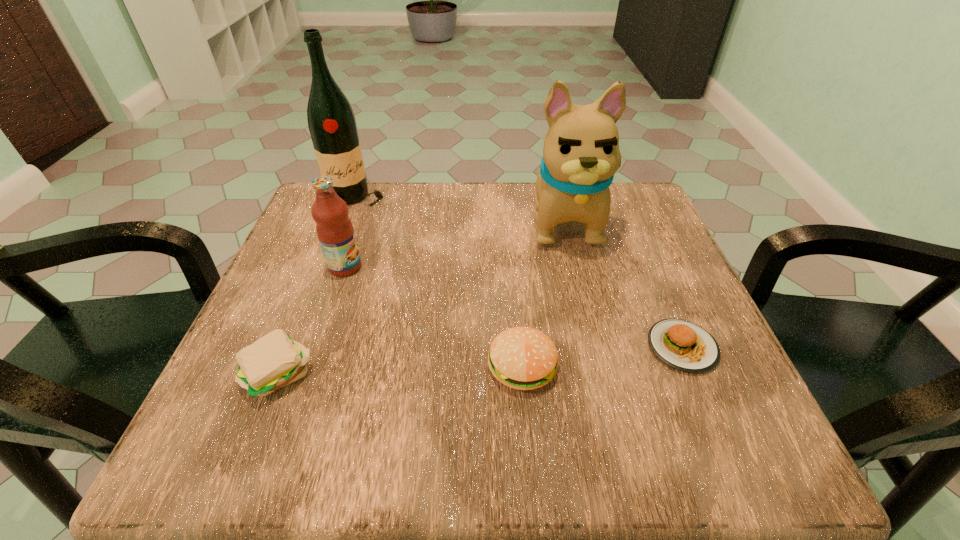
This screenshot has height=540, width=960. Identify the location of wine bottle. (331, 121).

Locate an element on the screen. The width and height of the screenshot is (960, 540). puppy is located at coordinates (581, 154).

The width and height of the screenshot is (960, 540). In order to click on the third tallest object in this screenshot , I will do `click(335, 231)`.

Image resolution: width=960 pixels, height=540 pixels. What are the coordinates of `the second food from left to right` in the screenshot? It's located at (523, 358).

At what (x,y) coordinates should I click in order to perform the action: click on the leftmost food. Please return your answer as a coordinate pair (x, y). Looking at the image, I should click on (275, 360).

At what (x,y) coordinates should I click in order to perform the action: click on the shortest object. Please return your answer as a coordinate pair (x, y). This screenshot has width=960, height=540. Looking at the image, I should click on (685, 346).

Identify the location of the rightmost food. (685, 346).

Find the location of `free space located 0.230m on the front of the wine bottle`. free space located 0.230m on the front of the wine bottle is located at coordinates (325, 282).

This screenshot has width=960, height=540. Find the location of `vacant space positioned 0.380m on the face of the puppy`. vacant space positioned 0.380m on the face of the puppy is located at coordinates click(x=613, y=425).

This screenshot has height=540, width=960. In order to click on vacant space situated on the front label of the third tallest object in this screenshot , I will do `click(521, 267)`.